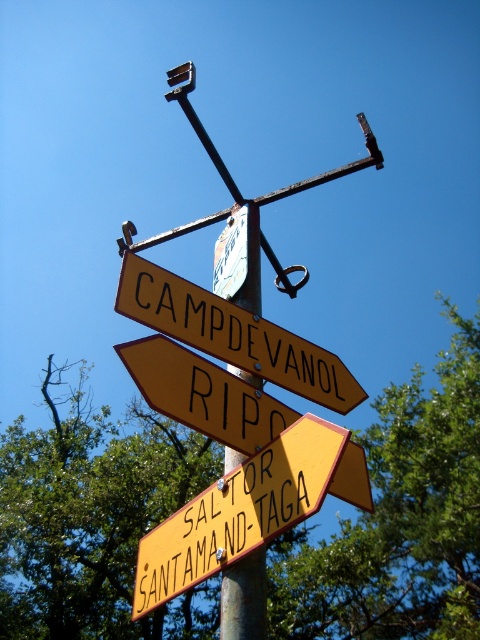
You are standing at the base of the metal signpost and want to go to CAMPDEVANOL. Which direction should you walk, towards the yellow matte signpost at upper center or the yellow matte signpost at center?

The yellow matte signpost at upper center is positioned over the yellow matte signpost at center. Since the topmost sign points to the left, you should walk towards the direction indicated by the yellow matte signpost at upper center.

You are standing in front of the metal signpost and see two yellow matte signpost at upper center and yellow matte signpost at center. Which one is positioned to the right side?

The yellow matte signpost at upper center is positioned to the right of the yellow matte signpost at center.